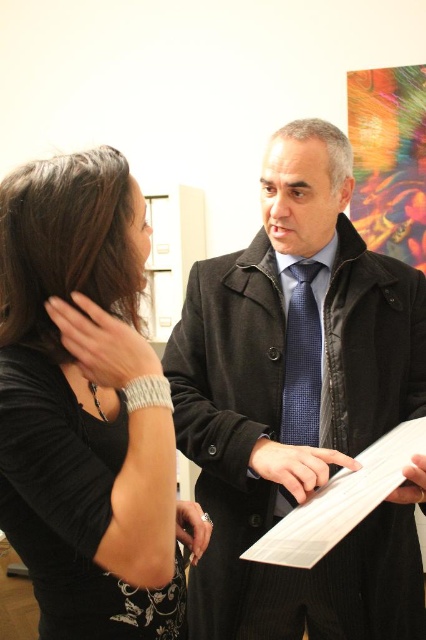
Question: Is black leather coat at center to the right of black matte shirt at left from the viewer's perspective?

Choices:
 (A) no
 (B) yes

Answer: (B)

Question: Does black leather coat at center appear on the right side of blue textured tie at center?

Choices:
 (A) no
 (B) yes

Answer: (A)

Question: Is black leather coat at center wider than blue textured tie at center?

Choices:
 (A) yes
 (B) no

Answer: (A)

Question: Among these objects, which one is farthest from the camera?

Choices:
 (A) blue textured tie at center
 (B) black matte shirt at left

Answer: (A)

Question: Considering the real-world distances, which object is closest to the black matte shirt at left?

Choices:
 (A) black leather coat at center
 (B) blue textured tie at center

Answer: (A)

Question: Which is nearer to the black matte shirt at left?

Choices:
 (A) blue textured tie at center
 (B) black leather coat at center

Answer: (B)